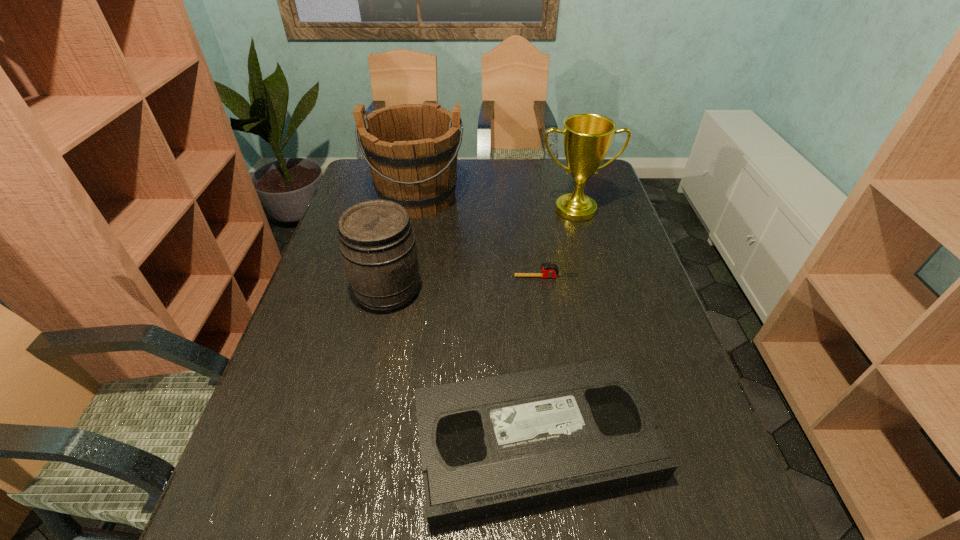
Where is `free space at the near left corner of the desktop`? The width and height of the screenshot is (960, 540). free space at the near left corner of the desktop is located at coordinates (276, 538).

At what (x,y) coordinates should I click in order to perform the action: click on vacant area between the nearer wine bucket and the award. Please return your answer as a coordinate pair (x, y). This screenshot has height=540, width=960. Looking at the image, I should click on (481, 251).

Identify the location of unoccupied area between the award and the shorter wine bucket. The width and height of the screenshot is (960, 540). (481, 251).

The height and width of the screenshot is (540, 960). I want to click on free space that is in between the award and the tape measure, so click(561, 244).

Locate an element on the screen. The image size is (960, 540). empty space that is in between the award and the farther wine bucket is located at coordinates (496, 204).

The image size is (960, 540). Identify the location of free point between the videotape and the shortest object. (540, 359).

Identify the location of free spot between the farther wine bucket and the tape measure. coord(482,237).

Find the location of a particular element. blank region between the tape measure and the shorter wine bucket is located at coordinates (467, 284).

At what (x,y) coordinates should I click in order to perform the action: click on free space that is in between the shorter wine bucket and the award. Please return your answer as a coordinate pair (x, y). The image size is (960, 540). Looking at the image, I should click on (481, 251).

You are a GUI agent. You are given a task and a screenshot of the screen. Output one action in this format:
    pyautogui.click(x=<x>, y=<y>)
    Task: Click on the empty space between the award and the nearest object
    This screenshot has height=540, width=960.
    Given the screenshot: What is the action you would take?
    pyautogui.click(x=555, y=325)